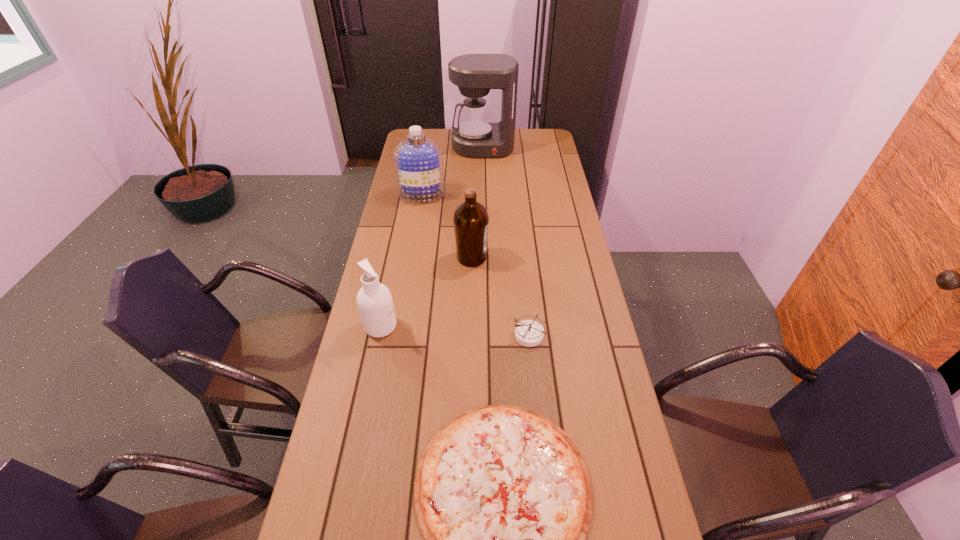
Locate an element on the screen. This screenshot has width=960, height=540. vacant region that satisfies the following two spatial constraints: 1. on the button side of the tallest object; 2. on the label of the olive oil is located at coordinates (484, 258).